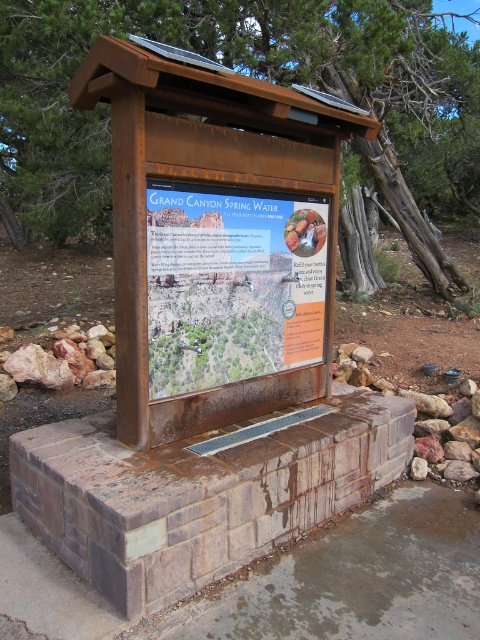
You are a park visitor trying to read the signs at the water station. Which sign, the rusty wood sign at upper center or the rustic wood sign at center, is closer to you?

The rusty wood sign at upper center is closer to you because the rustic wood sign at center is behind it.

You are standing at the water station and want to reach both the point at coordinates point (410, 68) and point (144, 272). Which point is closer to you?

Point (144, 272) is closer to you because it is less further away than point (410, 68).